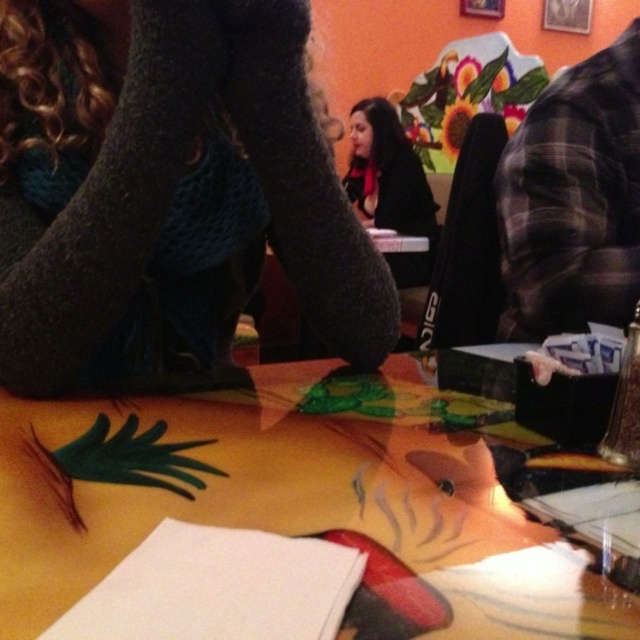
Between knitted dark gray socks at lower left and matte black jacket at center, which one appears on the left side from the viewer's perspective?

Positioned to the left is knitted dark gray socks at lower left.

The height and width of the screenshot is (640, 640). Describe the element at coordinates (168, 195) in the screenshot. I see `knitted dark gray socks at lower left` at that location.

Who is more distant from viewer, (144,166) or (372,225)?

The point (372,225) is more distant.

Image resolution: width=640 pixels, height=640 pixels. I want to click on knitted dark gray socks at lower left, so click(x=168, y=195).

Is wooden table at center to the left of matte black jacket at center from the viewer's perspective?

Indeed, wooden table at center is positioned on the left side of matte black jacket at center.

The image size is (640, 640). I want to click on wooden table at center, so click(x=296, y=506).

The height and width of the screenshot is (640, 640). Describe the element at coordinates (296, 506) in the screenshot. I see `wooden table at center` at that location.

Where is `wooden table at center`? wooden table at center is located at coordinates (296, 506).

Who is positioned more to the right, knitted dark gray socks at lower left or wooden table at center?

From the viewer's perspective, wooden table at center appears more on the right side.

You are a GUI agent. You are given a task and a screenshot of the screen. Output one action in this format:
    pyautogui.click(x=<x>, y=<y>)
    Task: Click on the knitted dark gray socks at lower left
    The height and width of the screenshot is (640, 640).
    Given the screenshot: What is the action you would take?
    pyautogui.click(x=168, y=195)

This screenshot has width=640, height=640. Find the location of `knitted dark gray socks at lower left`. knitted dark gray socks at lower left is located at coordinates (168, 195).